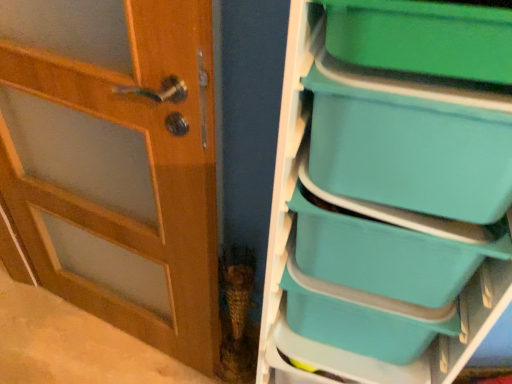
Question: From the image's perspective, is teal plastic storage box at right, marked as the first storage box in a bottom-to-top arrangement, beneath green plastic storage box at upper right, the first storage box in the top-to-bottom sequence?

Choices:
 (A) yes
 (B) no

Answer: (A)

Question: Can you confirm if teal plastic storage box at right, which ranks as the 4th storage box in top-to-bottom order, is thinner than green plastic storage box at upper right, the first storage box in the top-to-bottom sequence?

Choices:
 (A) no
 (B) yes

Answer: (B)

Question: Is teal plastic storage box at right, which ranks as the 4th storage box in top-to-bottom order, shorter than green plastic storage box at upper right, the first storage box in the top-to-bottom sequence?

Choices:
 (A) yes
 (B) no

Answer: (B)

Question: Considering the relative sizes of teal plastic storage box at right, marked as the first storage box in a bottom-to-top arrangement, and green plastic storage box at upper right, the 4th storage box positioned from the bottom, in the image provided, is teal plastic storage box at right, marked as the first storage box in a bottom-to-top arrangement, taller than green plastic storage box at upper right, the 4th storage box positioned from the bottom,?

Choices:
 (A) no
 (B) yes

Answer: (B)

Question: Can you confirm if teal plastic storage box at right, which ranks as the 4th storage box in top-to-bottom order, is wider than green plastic storage box at upper right, the first storage box in the top-to-bottom sequence?

Choices:
 (A) no
 (B) yes

Answer: (A)

Question: Is point (156, 314) closer or farther from the camera than point (321, 332)?

Choices:
 (A) farther
 (B) closer

Answer: (A)

Question: Is wooden door at left situated inside teal plastic storage box at right, marked as the first storage box in a bottom-to-top arrangement, or outside?

Choices:
 (A) inside
 (B) outside

Answer: (B)

Question: Considering the positions of wooden door at left and teal plastic storage box at right, which ranks as the 4th storage box in top-to-bottom order, in the image, is wooden door at left wider or thinner than teal plastic storage box at right, which ranks as the 4th storage box in top-to-bottom order,?

Choices:
 (A) wide
 (B) thin

Answer: (B)

Question: In terms of size, does wooden door at left appear bigger or smaller than teal plastic storage box at right, which ranks as the 4th storage box in top-to-bottom order?

Choices:
 (A) big
 (B) small

Answer: (A)

Question: From a real-world perspective, is wooden door at left physically located above or below teal plastic storage box at right, which ranks as the second storage box in bottom-to-top order?

Choices:
 (A) above
 (B) below

Answer: (B)

Question: Looking at their shapes, would you say wooden door at left is wider or thinner than teal plastic storage box at right, which ranks as the 3th storage box in top-to-bottom order?

Choices:
 (A) thin
 (B) wide

Answer: (A)

Question: Do you think wooden door at left is within teal plastic storage box at right, which ranks as the second storage box in bottom-to-top order, or outside of it?

Choices:
 (A) inside
 (B) outside

Answer: (B)

Question: From their relative heights in the image, would you say wooden door at left is taller or shorter than teal plastic storage box at right, which ranks as the 3th storage box in top-to-bottom order?

Choices:
 (A) short
 (B) tall

Answer: (B)

Question: Which is correct: teal plastic storage box at right, which ranks as the second storage box in bottom-to-top order, is inside teal plastic storage box at right, which ranks as the 4th storage box in top-to-bottom order, or outside of it?

Choices:
 (A) inside
 (B) outside

Answer: (B)

Question: In the image, is teal plastic storage box at right, which ranks as the 3th storage box in top-to-bottom order, on the left side or the right side of teal plastic storage box at right, which ranks as the 4th storage box in top-to-bottom order?

Choices:
 (A) left
 (B) right

Answer: (B)